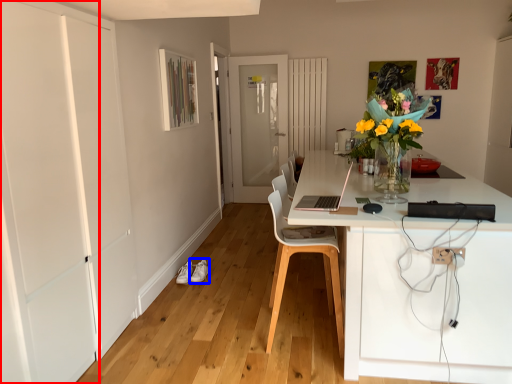
Question: Which object is closer to the camera taking this photo, door (highlighted by a red box) or shoe (highlighted by a blue box)?

Choices:
 (A) door
 (B) shoe

Answer: (A)